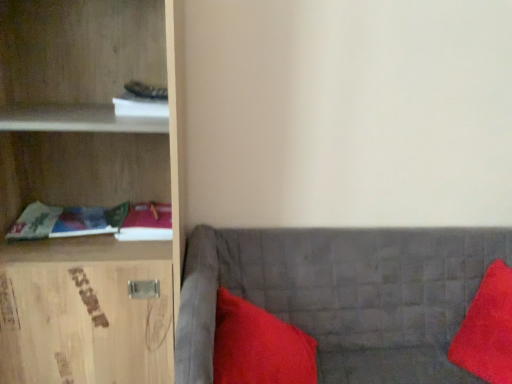
Question: Does velvet red pillow at right, placed as the 1th pillow when sorted from right to left, appear on the left side of velvet grey couch at lower right?

Choices:
 (A) no
 (B) yes

Answer: (A)

Question: Does velvet red pillow at right, the second pillow viewed from the left, lie in front of velvet grey couch at lower right?

Choices:
 (A) yes
 (B) no

Answer: (B)

Question: Is velvet red pillow at right, placed as the 1th pillow when sorted from right to left, not near velvet grey couch at lower right?

Choices:
 (A) no
 (B) yes

Answer: (A)

Question: Is velvet red pillow at right, placed as the 1th pillow when sorted from right to left, outside of velvet grey couch at lower right?

Choices:
 (A) yes
 (B) no

Answer: (B)

Question: Does velvet red pillow at right, the second pillow viewed from the left, have a smaller size compared to velvet grey couch at lower right?

Choices:
 (A) no
 (B) yes

Answer: (B)

Question: Is satin red pillow at lower right, acting as the first pillow starting from the left, in front of or behind velvet grey couch at lower right in the image?

Choices:
 (A) behind
 (B) front

Answer: (A)

Question: From the image's perspective, is satin red pillow at lower right, acting as the first pillow starting from the left, above or below velvet grey couch at lower right?

Choices:
 (A) above
 (B) below

Answer: (A)

Question: Is satin red pillow at lower right, acting as the first pillow starting from the left, wider or thinner than velvet grey couch at lower right?

Choices:
 (A) thin
 (B) wide

Answer: (A)

Question: In the image, is satin red pillow at lower right, which is the 2th pillow from right to left, on the left side or the right side of velvet grey couch at lower right?

Choices:
 (A) right
 (B) left

Answer: (B)

Question: Choose the correct answer: Is white paper at upper left, which is the 1th book in top-to-bottom order, inside matte red book at left, the 2th book from the top, or outside it?

Choices:
 (A) inside
 (B) outside

Answer: (B)

Question: Is white paper at upper left, which is the 1th book in top-to-bottom order, to the left or to the right of matte red book at left, the 2th book when ordered from bottom to top, in the image?

Choices:
 (A) right
 (B) left

Answer: (B)

Question: Does point (151, 114) appear closer or farther from the camera than point (156, 221)?

Choices:
 (A) closer
 (B) farther

Answer: (A)

Question: From the image's perspective, is white paper at upper left, which is the 1th book in top-to-bottom order, above or below matte red book at left, the 2th book when ordered from bottom to top?

Choices:
 (A) above
 (B) below

Answer: (A)

Question: Looking at the image, does satin red pillow at lower right, which is the 2th pillow from right to left, seem bigger or smaller compared to matte fabric book at left, arranged as the 3th book when viewed from the top?

Choices:
 (A) small
 (B) big

Answer: (B)

Question: From the image's perspective, relative to matte fabric book at left, the first book in the bottom-to-top sequence, is satin red pillow at lower right, acting as the first pillow starting from the left, above or below?

Choices:
 (A) above
 (B) below

Answer: (B)